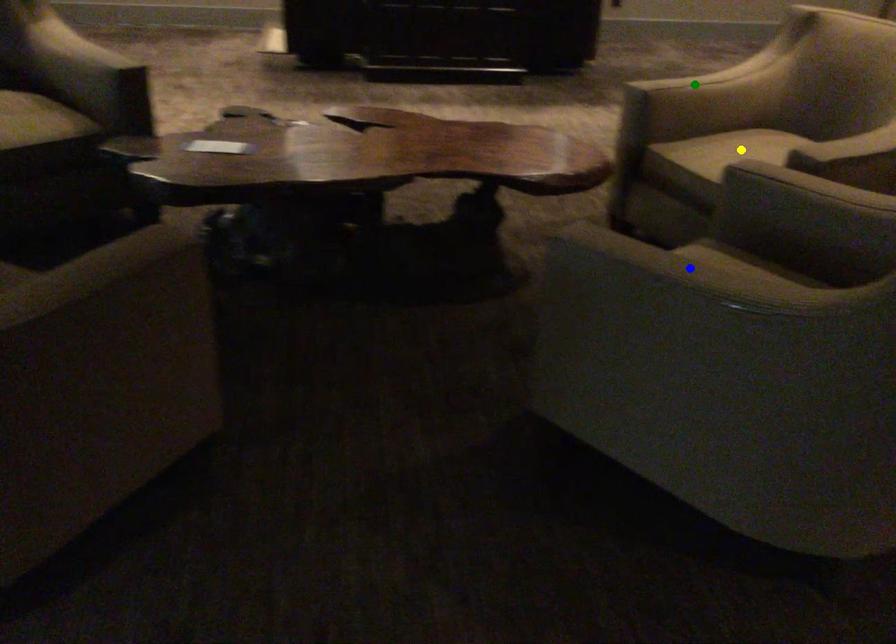
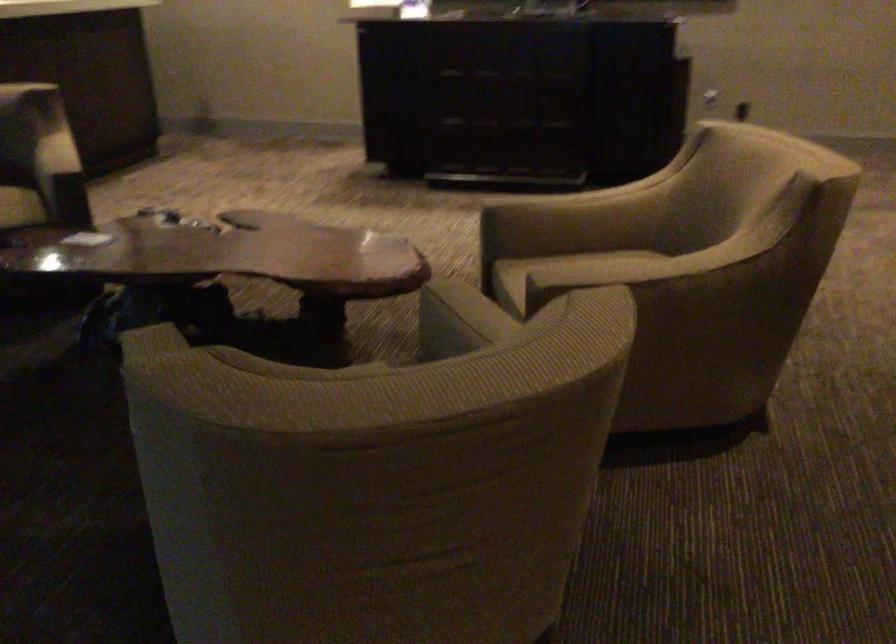
I am providing you with two images of the same scene from different viewpoints. Three points are marked in image1. Which point corresponds to a part or object that is occluded in image2?In image1, three points are marked. Which of them correspond to a part or object that is occluded in image2?Among the three points shown in image1, which one corresponds to a part or object that is no longer visible due to occlusion in image2?

Invisible in image2: yellow point, blue point.